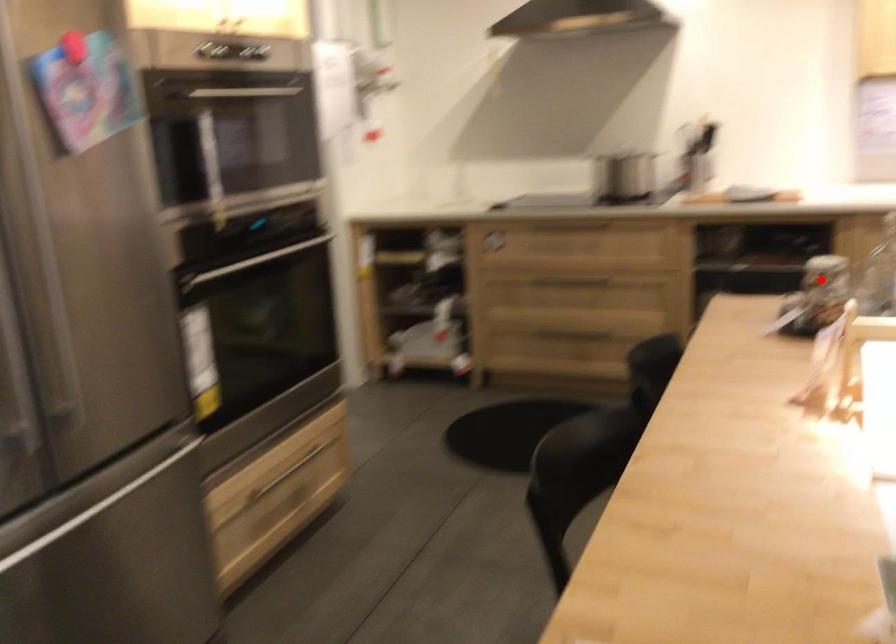
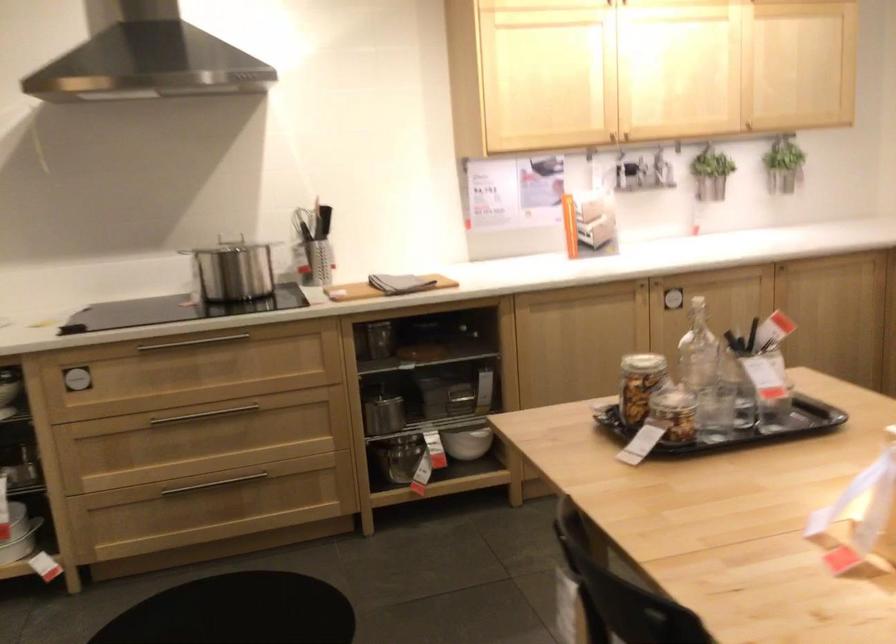
Question: A red point is marked in image1. In image2, is the corresponding 3D point closer to the camera or farther? Reply with the corresponding letter.

Choices:
 (A) The corresponding 3D point is closer.
 (B) The corresponding 3D point is farther.

Answer: (A)